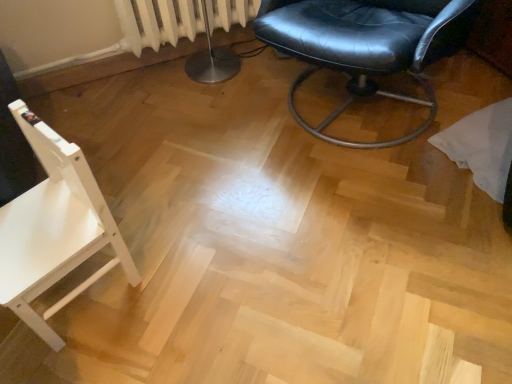
Describe the element at coordinates (156, 23) in the screenshot. The height and width of the screenshot is (384, 512). I see `white textured radiator at upper left` at that location.

Locate an element on the screen. white wood chair at left, the first chair in the bottom-to-top sequence is located at coordinates (54, 228).

Measure the distance between black leather chair at center, which appears as the 2th chair when viewed from the left, and camera.

A distance of 3.89 feet exists between black leather chair at center, which appears as the 2th chair when viewed from the left, and camera.

Find the location of a particular element. The width and height of the screenshot is (512, 384). white textured radiator at upper left is located at coordinates (156, 23).

Is white wood chair at left, positioned as the 2th chair in right-to-left order, shorter than white textured radiator at upper left?

No, white wood chair at left, positioned as the 2th chair in right-to-left order, is not shorter than white textured radiator at upper left.

Which point is more forward, (38, 186) or (142, 25)?

Point (38, 186)

From the picture: Is white wood chair at left, arranged as the second chair when viewed from the top, directly adjacent to white textured radiator at upper left?

No, white wood chair at left, arranged as the second chair when viewed from the top, is not making contact with white textured radiator at upper left.

Is white wood chair at left, positioned as the 2th chair in right-to-left order, inside the boundaries of white textured radiator at upper left, or outside?

white wood chair at left, positioned as the 2th chair in right-to-left order, is not inside white textured radiator at upper left, it's outside.

Which is more to the right, black leather chair at center, the 1th chair when ordered from right to left, or white textured radiator at upper left?

Positioned to the right is black leather chair at center, the 1th chair when ordered from right to left.

Looking at this image, considering the sizes of objects black leather chair at center, which appears as the 1th chair when viewed from the top, and white textured radiator at upper left in the image provided, who is bigger, black leather chair at center, which appears as the 1th chair when viewed from the top, or white textured radiator at upper left?

black leather chair at center, which appears as the 1th chair when viewed from the top.

Is black leather chair at center, which appears as the 1th chair when viewed from the top, turned away from white textured radiator at upper left?

No, black leather chair at center, which appears as the 1th chair when viewed from the top, is not facing away from white textured radiator at upper left.

How different are the orientations of black leather chair at center, the 1th chair when ordered from right to left, and white wood chair at left, arranged as the second chair when viewed from the top, in degrees?

3.3 degrees.

From a real-world perspective, is black leather chair at center, which appears as the 2th chair when viewed from the left, above or below white wood chair at left, arranged as the second chair when viewed from the top?

black leather chair at center, which appears as the 2th chair when viewed from the left, is above white wood chair at left, arranged as the second chair when viewed from the top.

From the image's perspective, between black leather chair at center, which appears as the 1th chair when viewed from the top, and white wood chair at left, arranged as the second chair when viewed from the top, who is located below?

white wood chair at left, arranged as the second chair when viewed from the top, is shown below in the image.

What's the angular difference between white wood chair at left, arranged as the second chair when viewed from the top, and black leather chair at center, which appears as the 2th chair when viewed from the left,'s facing directions?

The facing directions of white wood chair at left, arranged as the second chair when viewed from the top, and black leather chair at center, which appears as the 2th chair when viewed from the left, are 3.3 degrees apart.

From a real-world perspective, is white wood chair at left, the first chair in the bottom-to-top sequence, physically located above or below black leather chair at center, which appears as the 2th chair when viewed from the left?

white wood chair at left, the first chair in the bottom-to-top sequence, is below black leather chair at center, which appears as the 2th chair when viewed from the left.

Is white wood chair at left, arranged as the second chair when viewed from the top, in front of or behind black leather chair at center, which appears as the 2th chair when viewed from the left, in the image?

white wood chair at left, arranged as the second chair when viewed from the top, is in front of black leather chair at center, which appears as the 2th chair when viewed from the left.

Considering the positions of objects white wood chair at left, arranged as the second chair when viewed from the top, and black leather chair at center, which appears as the 1th chair when viewed from the top, in the image provided, who is more to the right, white wood chair at left, arranged as the second chair when viewed from the top, or black leather chair at center, which appears as the 1th chair when viewed from the top,?

Positioned to the right is black leather chair at center, which appears as the 1th chair when viewed from the top.

Looking at this image, in terms of width, does white textured radiator at upper left look wider or thinner when compared to white wood chair at left, arranged as the second chair when viewed from the top?

Considering their sizes, white textured radiator at upper left looks slimmer than white wood chair at left, arranged as the second chair when viewed from the top.

Is white textured radiator at upper left smaller than white wood chair at left, arranged as the second chair when viewed from the top?

Indeed, white textured radiator at upper left has a smaller size compared to white wood chair at left, arranged as the second chair when viewed from the top.

Can you see white textured radiator at upper left touching white wood chair at left, the first chair in the bottom-to-top sequence?

No, white textured radiator at upper left is not touching white wood chair at left, the first chair in the bottom-to-top sequence.

Is white wood chair at left, positioned as the 2th chair in right-to-left order, at the back of white textured radiator at upper left?

No, white textured radiator at upper left's orientation is not away from white wood chair at left, positioned as the 2th chair in right-to-left order.

Which point is more forward, (x=215, y=8) or (x=321, y=126)?

The point (x=321, y=126) is closer.

From a real-world perspective, which is physically below, white textured radiator at upper left or black leather chair at center, which appears as the 1th chair when viewed from the top?

white textured radiator at upper left.

Locate an element on the screen. This screenshot has width=512, height=384. radiator behind the black leather chair at center, which appears as the 2th chair when viewed from the left is located at coordinates (156, 23).

Locate an element on the screen. This screenshot has width=512, height=384. radiator located on the right of white wood chair at left, positioned as the 2th chair in right-to-left order is located at coordinates (156, 23).

Starting from the white textured radiator at upper left, which chair is the 1st one in front? Please provide its 2D coordinates.

[(367, 46)]

Based on their spatial positions, is black leather chair at center, which appears as the 1th chair when viewed from the top, or white wood chair at left, positioned as the 2th chair in right-to-left order, further from white textured radiator at upper left?

Among the two, white wood chair at left, positioned as the 2th chair in right-to-left order, is located further to white textured radiator at upper left.

Based on their spatial positions, is white wood chair at left, the first chair in the bottom-to-top sequence, or white textured radiator at upper left closer to black leather chair at center, which appears as the 1th chair when viewed from the top?

The object closer to black leather chair at center, which appears as the 1th chair when viewed from the top, is white textured radiator at upper left.

Looking at the image, which one is located closer to black leather chair at center, which appears as the 2th chair when viewed from the left, white textured radiator at upper left or white wood chair at left, the first chair in the bottom-to-top sequence?

white textured radiator at upper left is closer to black leather chair at center, which appears as the 2th chair when viewed from the left.

Based on their spatial positions, is white wood chair at left, arranged as the second chair when viewed from the top, or black leather chair at center, which appears as the 1th chair when viewed from the top, closer to white textured radiator at upper left?

Among the two, black leather chair at center, which appears as the 1th chair when viewed from the top, is located nearer to white textured radiator at upper left.

From the image, which object appears to be nearer to white wood chair at left, the first chair in the left-to-right sequence, white textured radiator at upper left or black leather chair at center, which appears as the 1th chair when viewed from the top?

black leather chair at center, which appears as the 1th chair when viewed from the top, lies closer to white wood chair at left, the first chair in the left-to-right sequence, than the other object.

Considering their positions, is black leather chair at center, which appears as the 2th chair when viewed from the left, positioned further to white wood chair at left, positioned as the 2th chair in right-to-left order, than white textured radiator at upper left?

Among the two, white textured radiator at upper left is located further to white wood chair at left, positioned as the 2th chair in right-to-left order.

Where is `radiator between white wood chair at left, the first chair in the left-to-right sequence, and black leather chair at center, which appears as the 2th chair when viewed from the left`? radiator between white wood chair at left, the first chair in the left-to-right sequence, and black leather chair at center, which appears as the 2th chair when viewed from the left is located at coordinates (156, 23).